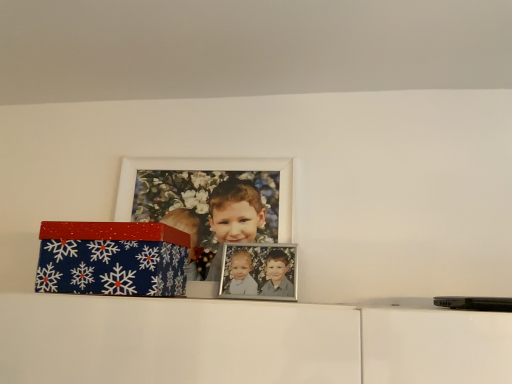
Question: Considering the relative positions of blue glittery box at left and white matte picture frame at upper center in the image provided, is blue glittery box at left in front of white matte picture frame at upper center?

Choices:
 (A) yes
 (B) no

Answer: (A)

Question: Would you consider blue glittery box at left to be distant from white matte picture frame at upper center?

Choices:
 (A) no
 (B) yes

Answer: (A)

Question: From a real-world perspective, is blue glittery box at left on white matte picture frame at upper center?

Choices:
 (A) yes
 (B) no

Answer: (B)

Question: Can you confirm if blue glittery box at left is thinner than white matte picture frame at upper center?

Choices:
 (A) no
 (B) yes

Answer: (A)

Question: Would you say white matte picture frame at upper center is part of blue glittery box at left's contents?

Choices:
 (A) yes
 (B) no

Answer: (B)

Question: Can you confirm if blue glittery box at left is positioned to the left of white matte picture frame at upper center?

Choices:
 (A) no
 (B) yes

Answer: (B)

Question: Is white matte picture frame at upper center taller than blue glittery box at left?

Choices:
 (A) no
 (B) yes

Answer: (B)

Question: From a real-world perspective, does white matte picture frame at upper center sit lower than blue glittery box at left?

Choices:
 (A) yes
 (B) no

Answer: (B)

Question: Is white matte picture frame at upper center bigger than blue glittery box at left?

Choices:
 (A) no
 (B) yes

Answer: (A)

Question: Would you consider white matte picture frame at upper center to be distant from blue glittery box at left?

Choices:
 (A) yes
 (B) no

Answer: (B)

Question: Is white matte picture frame at upper center at the left side of blue glittery box at left?

Choices:
 (A) yes
 (B) no

Answer: (B)

Question: From a real-world perspective, is white matte picture frame at upper center on blue glittery box at left?

Choices:
 (A) no
 (B) yes

Answer: (B)

Question: Choose the correct answer: Is white matte picture frame at upper center inside blue glittery box at left or outside it?

Choices:
 (A) outside
 (B) inside

Answer: (A)